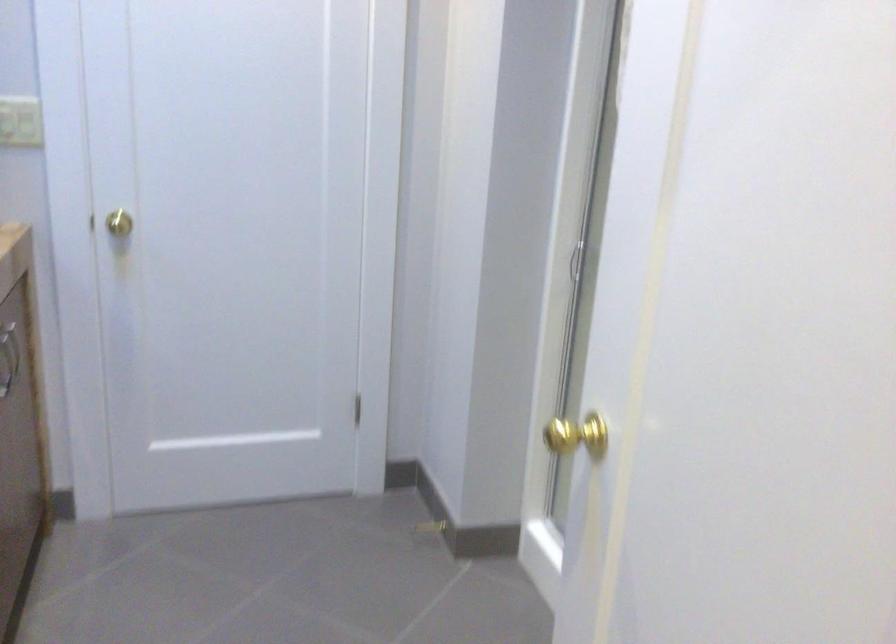
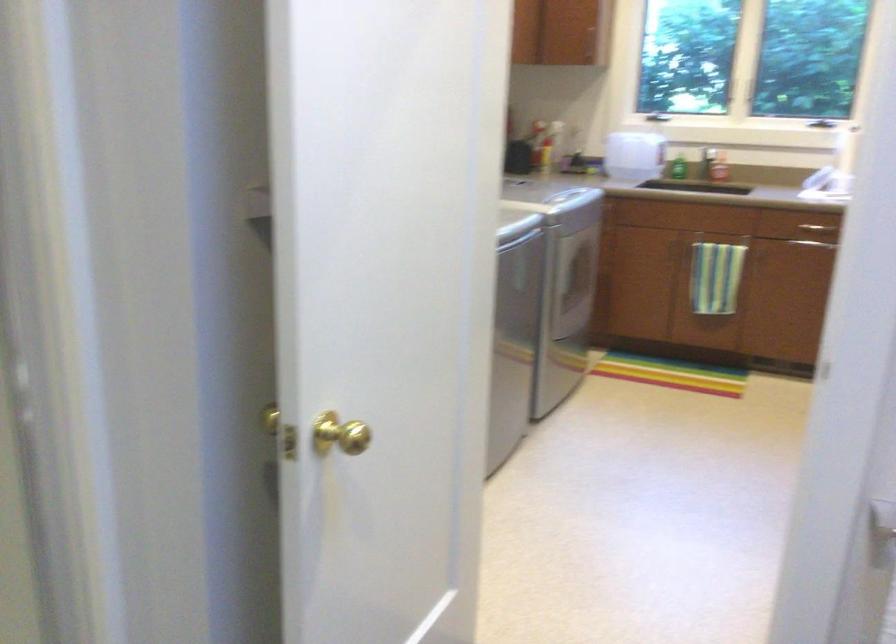
Locate, in the second image, the point that corresponds to point 639,496 in the first image.

(339, 433)